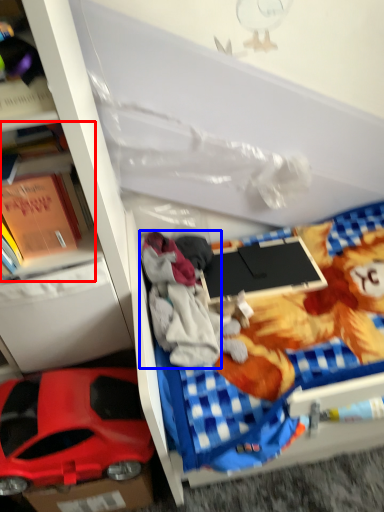
Question: Among these objects, which one is farthest to the camera, book (highlighted by a red box) or clothing (highlighted by a blue box)?

Choices:
 (A) book
 (B) clothing

Answer: (B)